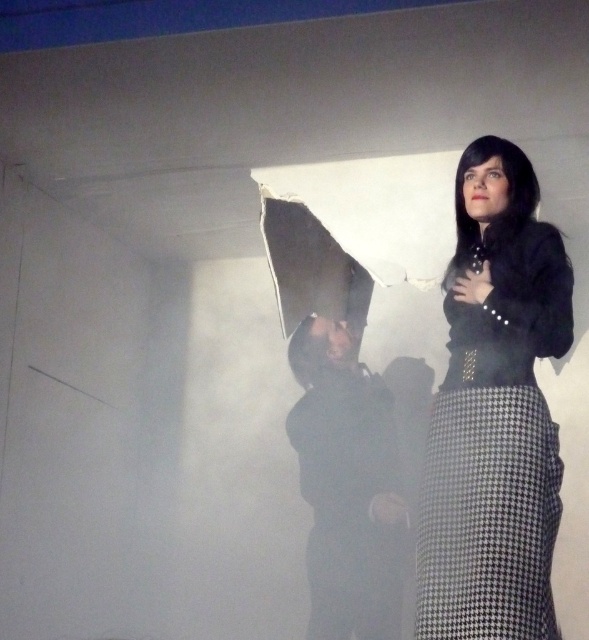
Question: Is black textured skirt at center smaller than black matte jacket at center?

Choices:
 (A) yes
 (B) no

Answer: (A)

Question: Does black textured skirt at center come behind black matte jacket at center?

Choices:
 (A) yes
 (B) no

Answer: (B)

Question: Can you confirm if black textured skirt at center is positioned to the right of black matte jacket at center?

Choices:
 (A) no
 (B) yes

Answer: (B)